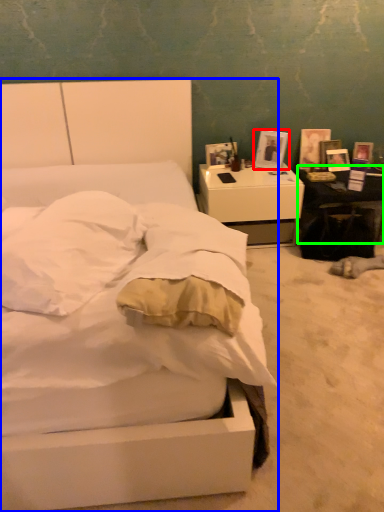
Question: Which is nearer to the picture frame (highlighted by a red box)? bed (highlighted by a blue box) or table (highlighted by a green box).

Choices:
 (A) bed
 (B) table

Answer: (B)